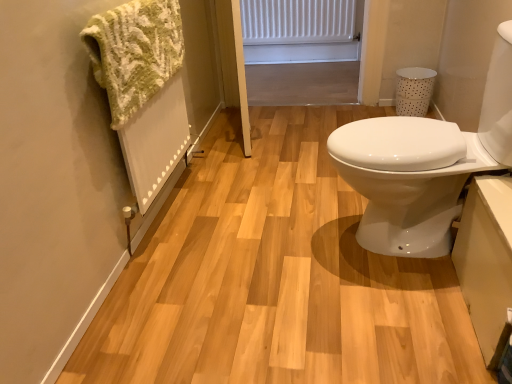
Question: Is white matte radiator at upper center completely or partially inside white glossy sink at right?

Choices:
 (A) yes
 (B) no

Answer: (B)

Question: Is white glossy sink at right facing towards white matte radiator at upper center?

Choices:
 (A) yes
 (B) no

Answer: (B)

Question: Is white glossy sink at right bigger than white matte radiator at upper center?

Choices:
 (A) no
 (B) yes

Answer: (B)

Question: Is white glossy sink at right smaller than white matte radiator at upper center?

Choices:
 (A) yes
 (B) no

Answer: (B)

Question: Is white glossy sink at right looking in the opposite direction of white matte radiator at upper center?

Choices:
 (A) no
 (B) yes

Answer: (A)

Question: Is white glossy sink at right not close to white matte radiator at upper center?

Choices:
 (A) yes
 (B) no

Answer: (A)

Question: Does white matte radiator at upper center have a greater width compared to green knitted towel at left?

Choices:
 (A) yes
 (B) no

Answer: (B)

Question: Is white matte radiator at upper center at the right side of green knitted towel at left?

Choices:
 (A) no
 (B) yes

Answer: (B)

Question: From a real-world perspective, is white matte radiator at upper center below green knitted towel at left?

Choices:
 (A) no
 (B) yes

Answer: (B)

Question: Is green knitted towel at left a part of white matte radiator at upper center?

Choices:
 (A) yes
 (B) no

Answer: (B)

Question: Considering the relative sizes of white matte radiator at upper center and green knitted towel at left in the image provided, is white matte radiator at upper center taller than green knitted towel at left?

Choices:
 (A) yes
 (B) no

Answer: (B)

Question: Is white matte radiator at upper center beside green knitted towel at left?

Choices:
 (A) yes
 (B) no

Answer: (B)

Question: Is green knitted towel at left taller than white glossy sink at right?

Choices:
 (A) no
 (B) yes

Answer: (A)